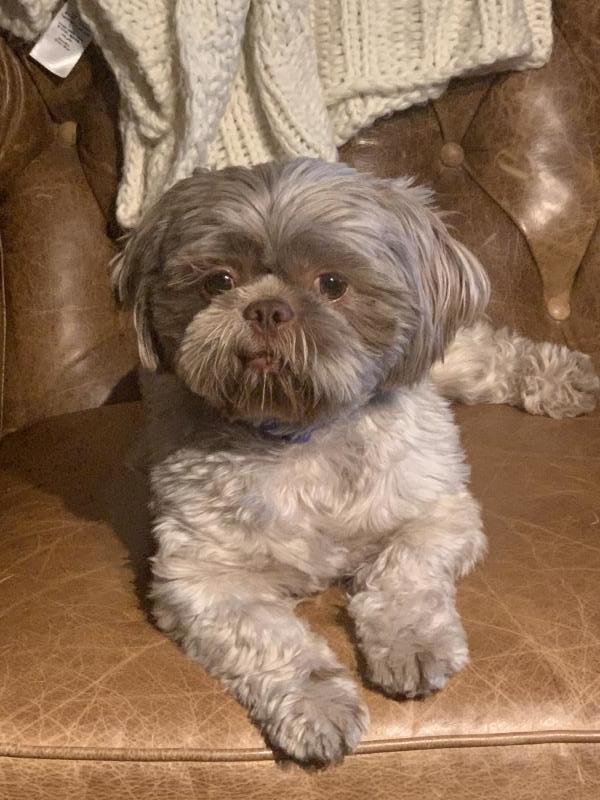
This screenshot has height=800, width=600. In order to click on leather in this screenshot , I will do `click(73, 245)`, `click(512, 184)`, `click(85, 642)`.